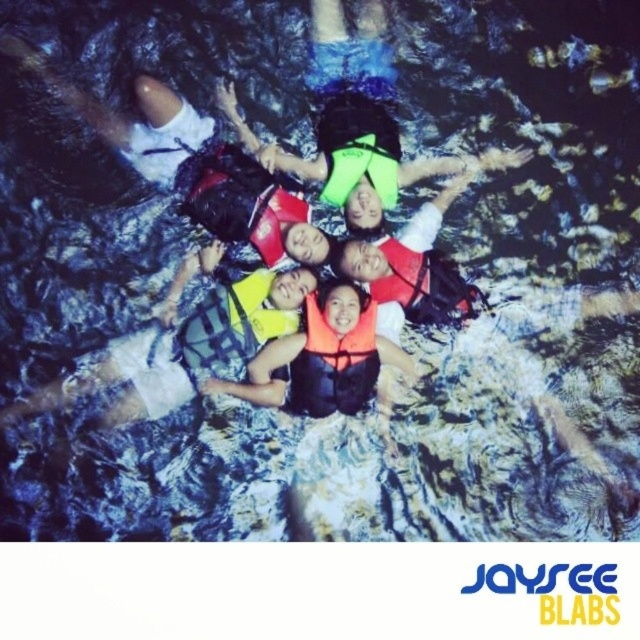
Does neon yellow life jacket at center have a greater width compared to orange life jacket at center?

Indeed, neon yellow life jacket at center has a greater width compared to orange life jacket at center.

Measure the distance between neon yellow life jacket at center and orange life jacket at center.

neon yellow life jacket at center is 16.27 inches from orange life jacket at center.

Consider the image. Who is more distant from viewer, (250, 307) or (262, 220)?

The point (262, 220) is behind.

Find the location of a particular element. neon yellow life jacket at center is located at coordinates (234, 321).

Measure the distance between yellow life vest at center and orange life jacket at center.

yellow life vest at center is 21.57 inches from orange life jacket at center.

Between point (262, 284) and point (301, 214), which one is positioned behind?

Positioned behind is point (301, 214).

This screenshot has width=640, height=640. I want to click on yellow life vest at center, so click(188, 346).

Who is positioned more to the right, orange life vest at center or orange soft life jacket at center?

orange soft life jacket at center

Identify the location of orange life vest at center. (323, 356).

Where is `orange life vest at center`? The height and width of the screenshot is (640, 640). orange life vest at center is located at coordinates (323, 356).